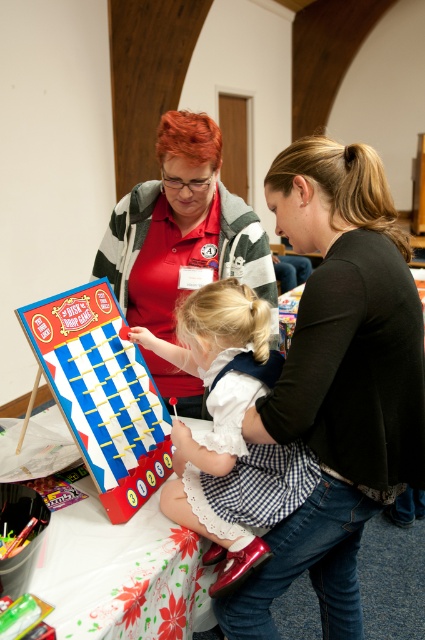
You are holding a camera and want to take a photo of the Disk Toss Game. The camera is positioned at point (351, 177). The camera is 1.11 meters away from the Disk Toss Game. Is the camera close enough to take a clear photo?

The camera is positioned at point (351, 177) and is 1.11 meters away from the Disk Toss Game. Since the distance is within a typical comfortable range for photography, the camera is close enough to take a clear photo.